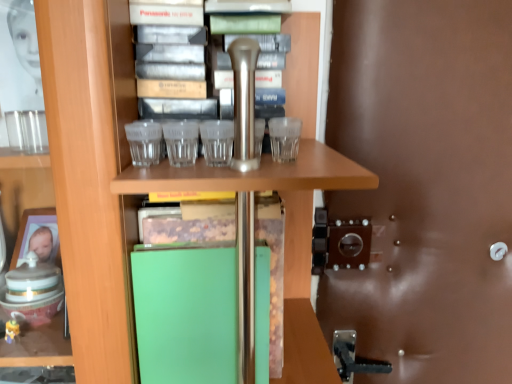
Question: From the image's perspective, is brown leather door at right above or below green matte folder at center?

Choices:
 (A) above
 (B) below

Answer: (A)

Question: In the image, is brown leather door at right positioned in front of or behind green matte folder at center?

Choices:
 (A) front
 (B) behind

Answer: (B)

Question: Is brown leather door at right taller or shorter than green matte folder at center?

Choices:
 (A) short
 (B) tall

Answer: (B)

Question: Is point (120, 192) positioned closer to the camera than point (436, 152)?

Choices:
 (A) farther
 (B) closer

Answer: (B)

Question: Which is correct: green matte folder at center is inside brown leather door at right, or outside of it?

Choices:
 (A) inside
 (B) outside

Answer: (B)

Question: Considering their positions, is green matte folder at center located in front of or behind brown leather door at right?

Choices:
 (A) behind
 (B) front

Answer: (B)

Question: Visually, is green matte folder at center positioned to the left or to the right of brown leather door at right?

Choices:
 (A) right
 (B) left

Answer: (B)